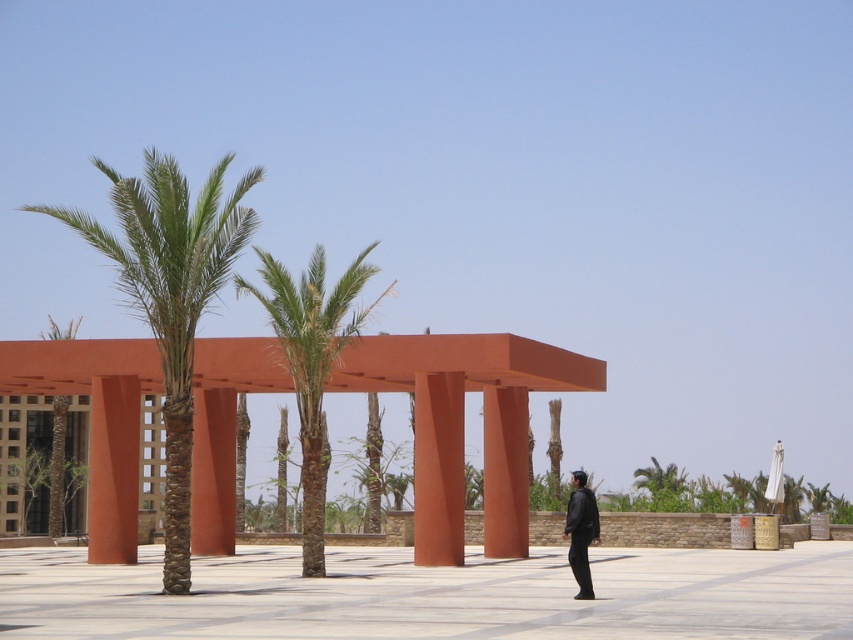
You are standing at the camera position looking at the scene. What are the coordinates of the green leafy palm tree at center in the image?

The green leafy palm tree at center is located at coordinates (x=312, y=362).

You are standing in the open outdoor space and want to walk from the point at coordinates point (291,321) to the point at coordinates point (582,556). Which direction should you move to get closer to your destination?

To move from point (291,321) to point (582,556), you should move towards the upper right direction since point (582,556) is located further away from the viewer compared to point (291,321).

You are standing in the open space and want to place a small potted plant between the black leather jacket at lower right and the green leafy palm tree at left. Based on their sizes, which object would allow more space for the potted plant?

The green leafy palm tree at left occupies more space than the black leather jacket at lower right, so placing the potted plant near the palm tree would allow more space for it.